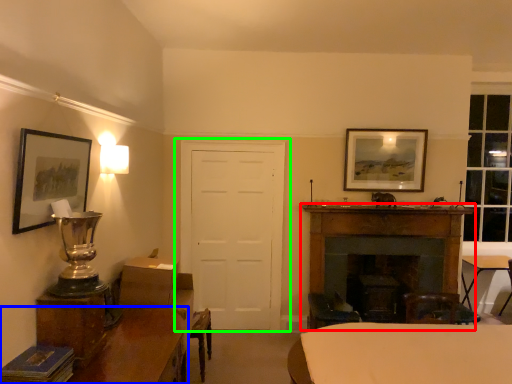
Question: Considering the real-world distances, which object is farthest from fireplace (highlighted by a red box)? table (highlighted by a blue box) or door (highlighted by a green box)?

Choices:
 (A) table
 (B) door

Answer: (A)